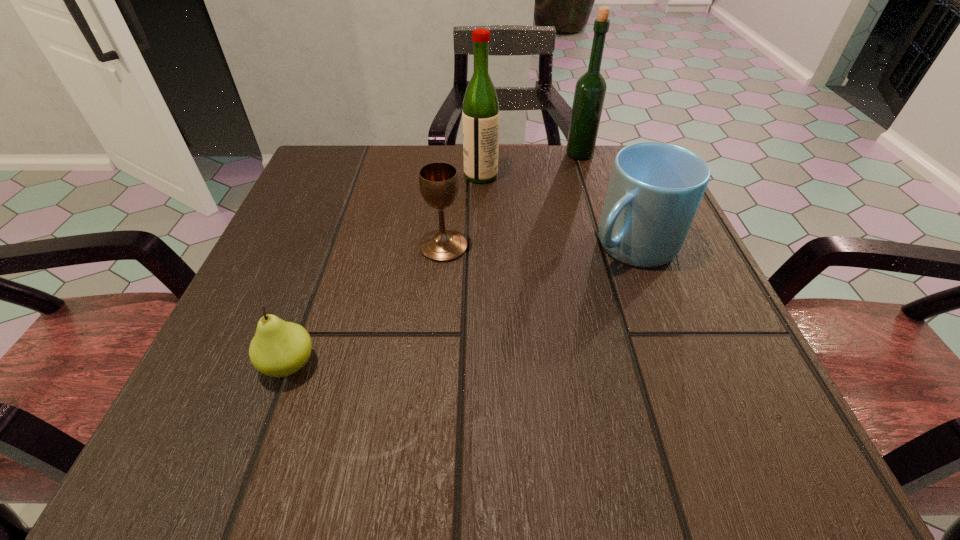
Identify the location of blank space located 0.190m on the label of the nearer liquor. (375, 176).

Locate an element on the screen. free space located 0.140m on the label of the nearer liquor is located at coordinates (398, 176).

Locate an element on the screen. free space located 0.080m on the back of the mug is located at coordinates (613, 194).

Image resolution: width=960 pixels, height=540 pixels. Identify the location of free space located on the left of the chalice. (386, 246).

Locate an element on the screen. This screenshot has width=960, height=540. vacant region located on the back of the pear is located at coordinates (353, 186).

This screenshot has width=960, height=540. Find the location of `object present at the left edge`. object present at the left edge is located at coordinates (279, 348).

This screenshot has height=540, width=960. Identify the location of liquor positioned at the right edge. (590, 89).

Where is `mug present at the right edge`? The image size is (960, 540). mug present at the right edge is located at coordinates (655, 188).

This screenshot has height=540, width=960. Find the location of `object that is positioned at the far right corner`. object that is positioned at the far right corner is located at coordinates (590, 89).

This screenshot has width=960, height=540. I want to click on vacant region at the far edge of the desktop, so click(405, 204).